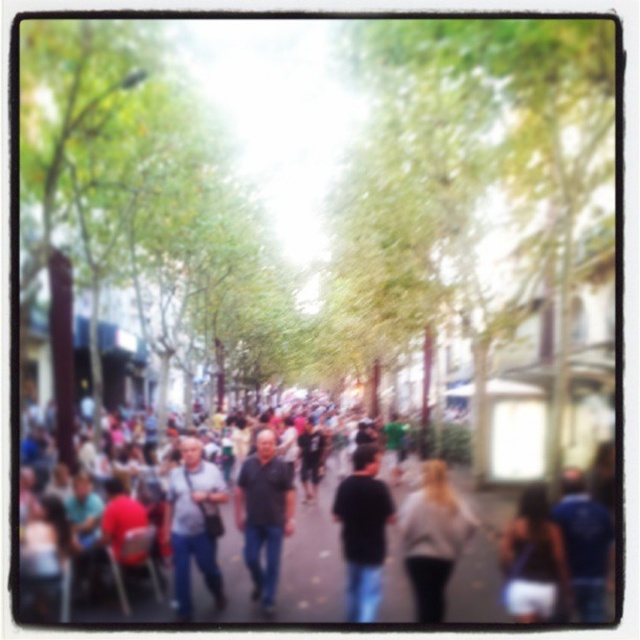
You are a street performer planning to set up a small stage between the light gray sweater at center and the black matte shirt at center. Given that the stage requires a minimum width of 1.2 meters, can you determine if there is enough space between them?

The light gray sweater at center might be wider than black matte shirt at center, but without exact measurements, it is uncertain if the space between them meets the required 1.2 meters. Consider measuring the distance before setting up the stage.

You are standing on the smooth asphalt road at center. A friend is holding an umbrella and standing under the trees to your left. Can you see their umbrella from where you are standing?

Yes, you can see the umbrella because the trees are tall and the canopy might not block the view completely, allowing visibility from the smooth asphalt road at center.